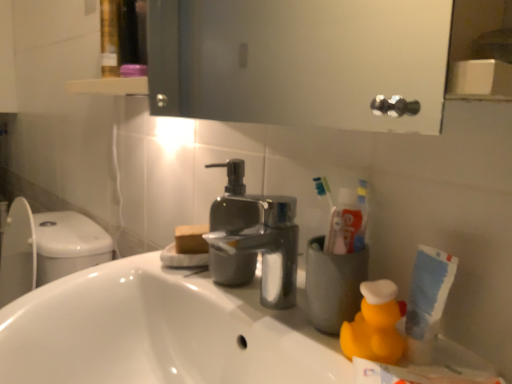
Question: Does yellow rubber duck at lower right have a greater width compared to white glossy sink at lower left?

Choices:
 (A) no
 (B) yes

Answer: (A)

Question: Is yellow rubber duck at lower right closer to camera compared to white glossy sink at lower left?

Choices:
 (A) no
 (B) yes

Answer: (A)

Question: Are yellow rubber duck at lower right and white glossy sink at lower left far apart?

Choices:
 (A) no
 (B) yes

Answer: (A)

Question: Is yellow rubber duck at lower right not within white glossy sink at lower left?

Choices:
 (A) yes
 (B) no

Answer: (A)

Question: Is yellow rubber duck at lower right bigger than white glossy sink at lower left?

Choices:
 (A) yes
 (B) no

Answer: (B)

Question: Does point (275, 299) appear closer or farther from the camera than point (296, 357)?

Choices:
 (A) farther
 (B) closer

Answer: (A)

Question: Which is correct: polished metallic faucet at center is inside white glossy sink at lower left, or outside of it?

Choices:
 (A) inside
 (B) outside

Answer: (B)

Question: Considering their positions, is polished metallic faucet at center located in front of or behind white glossy sink at lower left?

Choices:
 (A) behind
 (B) front

Answer: (A)

Question: Is polished metallic faucet at center to the left or to the right of white glossy sink at lower left in the image?

Choices:
 (A) right
 (B) left

Answer: (A)

Question: From the image's perspective, relative to white glossy sink at lower left, is yellow rubber duck at lower right above or below?

Choices:
 (A) below
 (B) above

Answer: (B)

Question: Relative to white glossy sink at lower left, is yellow rubber duck at lower right in front or behind?

Choices:
 (A) behind
 (B) front

Answer: (A)

Question: From a real-world perspective, is yellow rubber duck at lower right above or below white glossy sink at lower left?

Choices:
 (A) below
 (B) above

Answer: (B)

Question: Is point (377, 359) positioned closer to the camera than point (38, 345)?

Choices:
 (A) farther
 (B) closer

Answer: (B)

Question: Choose the correct answer: Is polished metallic faucet at center inside yellow rubber duck at lower right or outside it?

Choices:
 (A) outside
 (B) inside

Answer: (A)

Question: Relative to yellow rubber duck at lower right, is polished metallic faucet at center in front or behind?

Choices:
 (A) front
 (B) behind

Answer: (B)